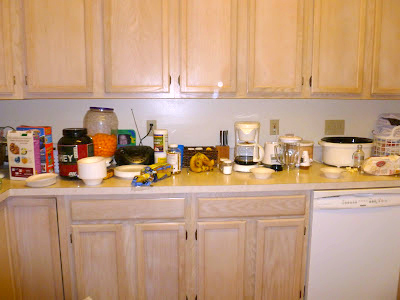
I want to click on knife block, so click(223, 149).